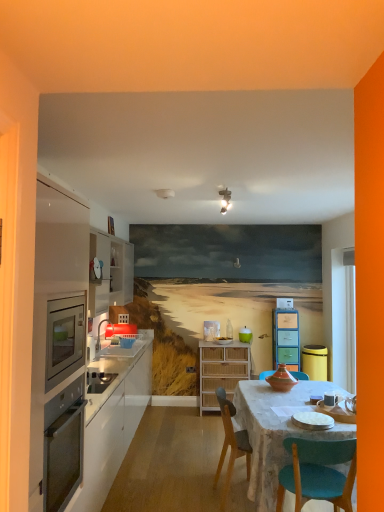
Question: From the image's perspective, is marble table at center located above or below satin white cabinetry at left, which ranks as the third cabinetry in right-to-left order?

Choices:
 (A) above
 (B) below

Answer: (B)

Question: Does point (238, 395) appear closer or farther from the camera than point (31, 440)?

Choices:
 (A) closer
 (B) farther

Answer: (B)

Question: Considering the real-world distances, which object is closest to the teal plastic cup at center?

Choices:
 (A) white ceramic plate at center
 (B) white glossy cabinetry at left, positioned as the first cabinetry in left-to-right order
 (C) marble table at center
 (D) bamboo cabinet at center, acting as the second cabinetry starting from the back
 (E) matte white sink at left

Answer: (D)

Question: Which object is the farthest from the wooden chair at center?

Choices:
 (A) pastel multi-colored cabinet at center, placed as the first cabinetry when sorted from right to left
 (B) bamboo cabinet at center, acting as the second cabinetry starting from the back
 (C) matte white sink at left
 (D) satin white cabinetry at left, the first cabinetry positioned from the front
 (E) white ceramic plate at center

Answer: (A)